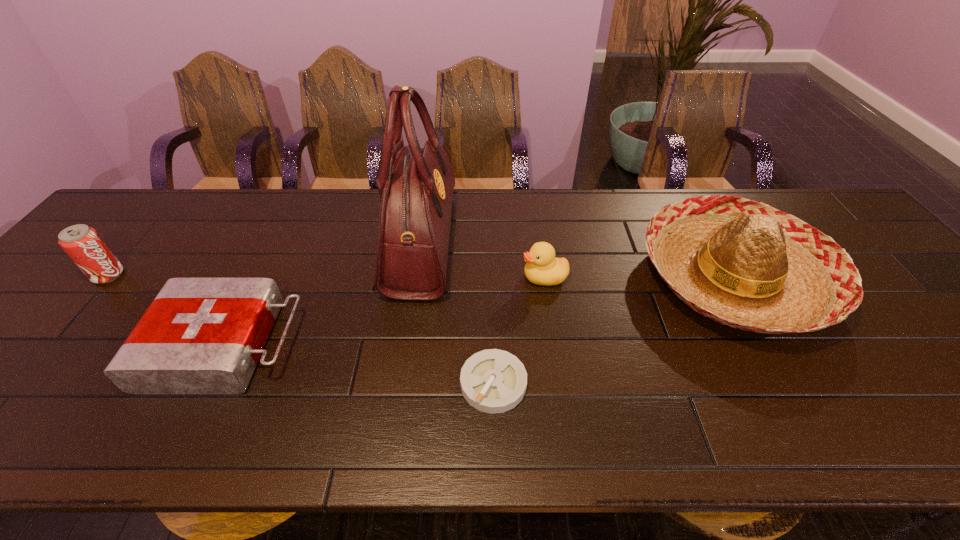
Identify the location of the fourth object from left to right. (493, 381).

The width and height of the screenshot is (960, 540). What are the coordinates of `ashtray` in the screenshot? It's located at (493, 381).

At what (x,y) coordinates should I click in order to perform the action: click on free point located on the front-facing side of the fourth object from right to left. Please return your answer as a coordinate pair (x, y). The width and height of the screenshot is (960, 540). Looking at the image, I should click on (516, 242).

You are a GUI agent. You are given a task and a screenshot of the screen. Output one action in this format:
    pyautogui.click(x=<x>, y=<y>)
    Task: Click on the vacant space located on the back of the fifth shortest object
    
    Given the screenshot: What is the action you would take?
    pyautogui.click(x=694, y=206)

I want to click on vacant space situated 0.080m on the right of the fourth shortest object, so click(x=154, y=275).

At what (x,y) coordinates should I click in order to perform the action: click on vacant space located 0.290m at the beak of the duck. Please return your answer as a coordinate pair (x, y). This screenshot has height=540, width=960. Looking at the image, I should click on (411, 278).

The height and width of the screenshot is (540, 960). In order to click on free region located 0.060m at the beak of the duck in this screenshot , I will do `click(498, 278)`.

At what (x,y) coordinates should I click in order to perform the action: click on vacant space positioned 0.340m at the beak of the duck. Please return your answer as a coordinate pair (x, y). The height and width of the screenshot is (540, 960). Looking at the image, I should click on (392, 278).

I want to click on vacant space situated 0.280m on the front side of the fifth object from right to left, so click(420, 345).

The width and height of the screenshot is (960, 540). I want to click on vacant space located on the back of the shortest object, so click(491, 252).